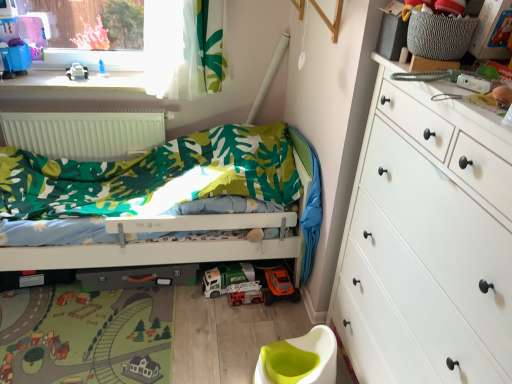
Identify the location of free space to the right of white plastic toy car at upper left. pyautogui.click(x=105, y=79).